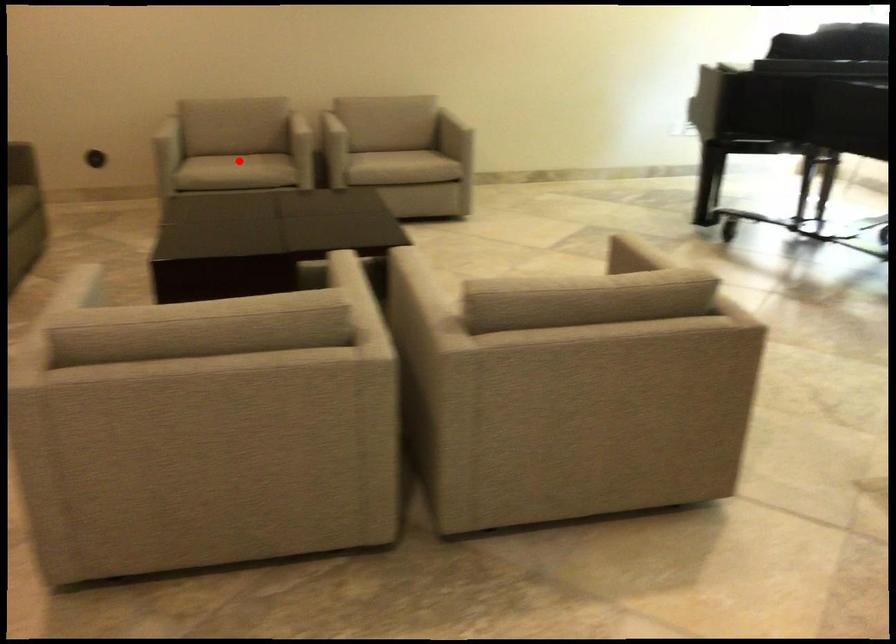
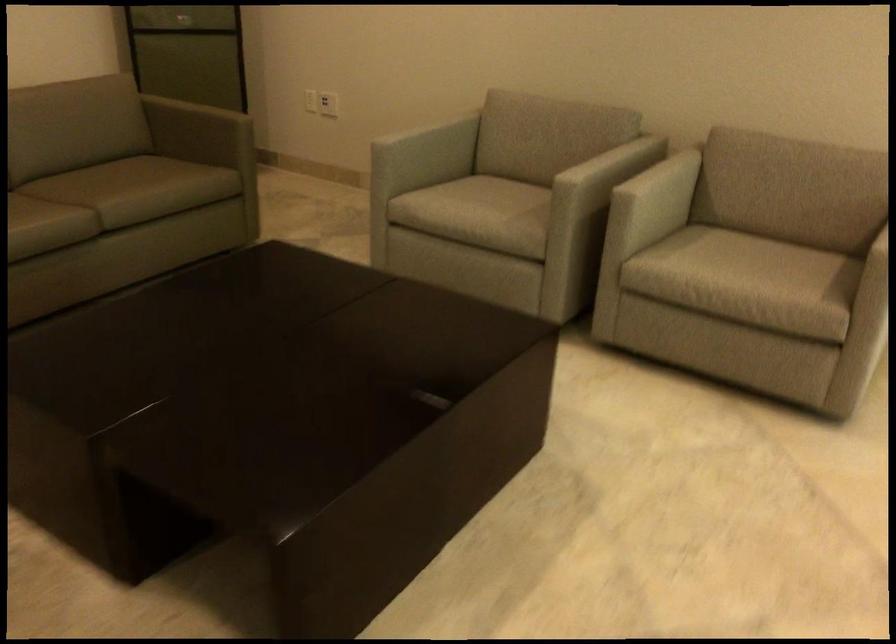
In the second image, find the point that corresponds to the highlighted location in the first image.

(480, 207)